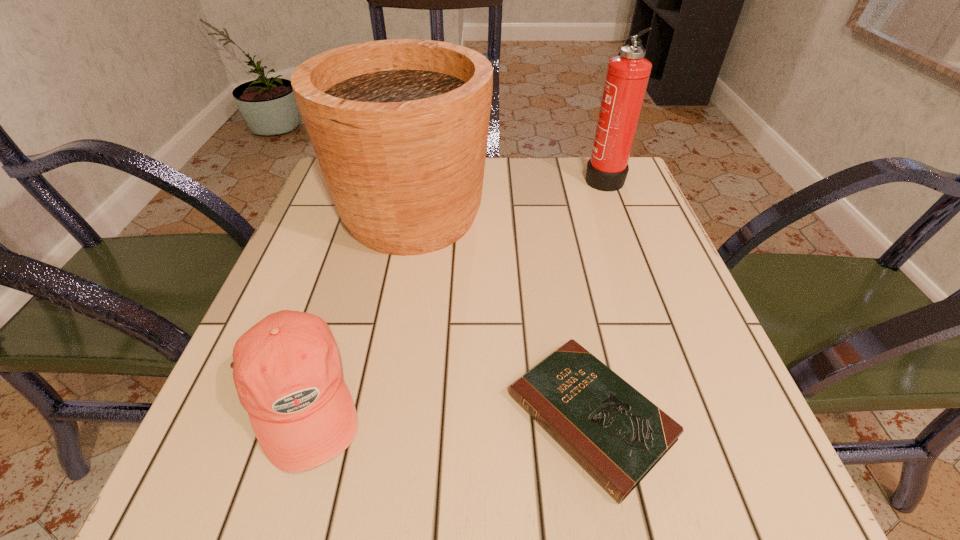
Identify the location of fire extinguisher. The height and width of the screenshot is (540, 960). (627, 76).

You are a GUI agent. You are given a task and a screenshot of the screen. Output one action in this format:
    pyautogui.click(x=<x>, y=<y>)
    Task: Click on the flowerpot
    This screenshot has width=960, height=540.
    Given the screenshot: What is the action you would take?
    pyautogui.click(x=400, y=127)

Locate an element on the screen. This screenshot has height=540, width=960. baseball cap is located at coordinates (286, 368).

Locate an element on the screen. the shortest object is located at coordinates pos(617,435).

Identify the location of vacant area located on the front-facing side of the fire extinguisher. (504, 177).

The image size is (960, 540). I want to click on free point located on the front-facing side of the fire extinguisher, so click(560, 177).

Identify the location of free region located on the front-facing side of the fire extinguisher. (548, 177).

Where is `free space located 0.320m on the right of the flowerpot`? Image resolution: width=960 pixels, height=540 pixels. free space located 0.320m on the right of the flowerpot is located at coordinates (632, 215).

I want to click on vacant space positioned 0.400m on the back of the baseball cap, so click(363, 203).

Where is `free spot located on the left of the shortest object`? This screenshot has width=960, height=540. free spot located on the left of the shortest object is located at coordinates (264, 417).